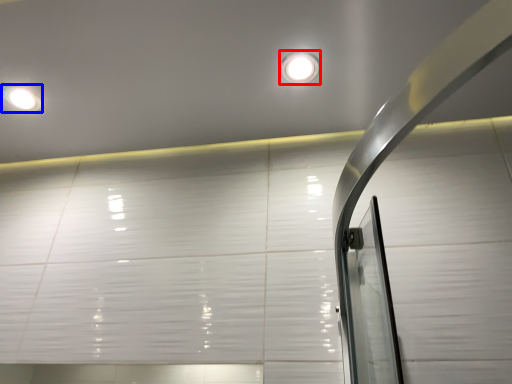
Question: Among these objects, which one is farthest to the camera, droplight (highlighted by a red box) or droplight (highlighted by a blue box)?

Choices:
 (A) droplight
 (B) droplight

Answer: (B)